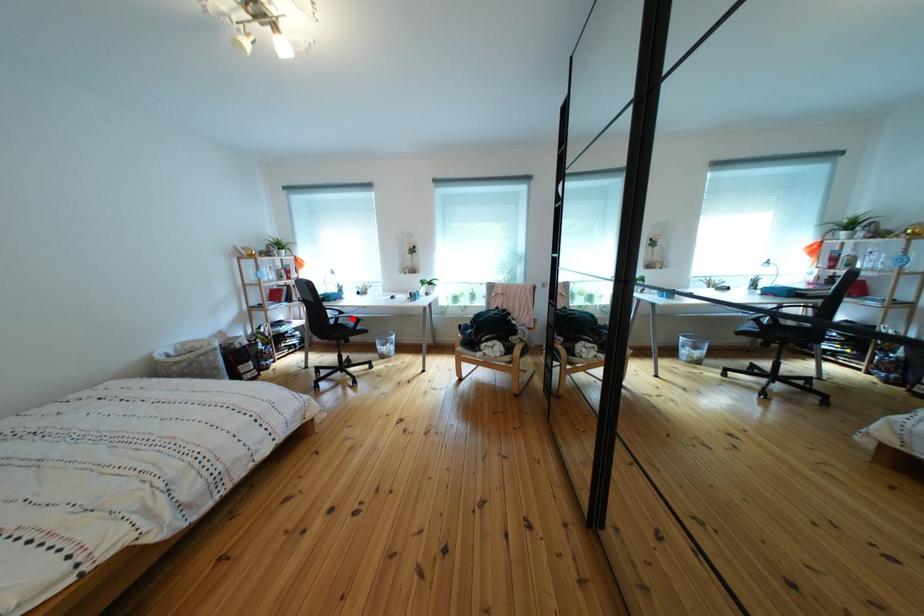
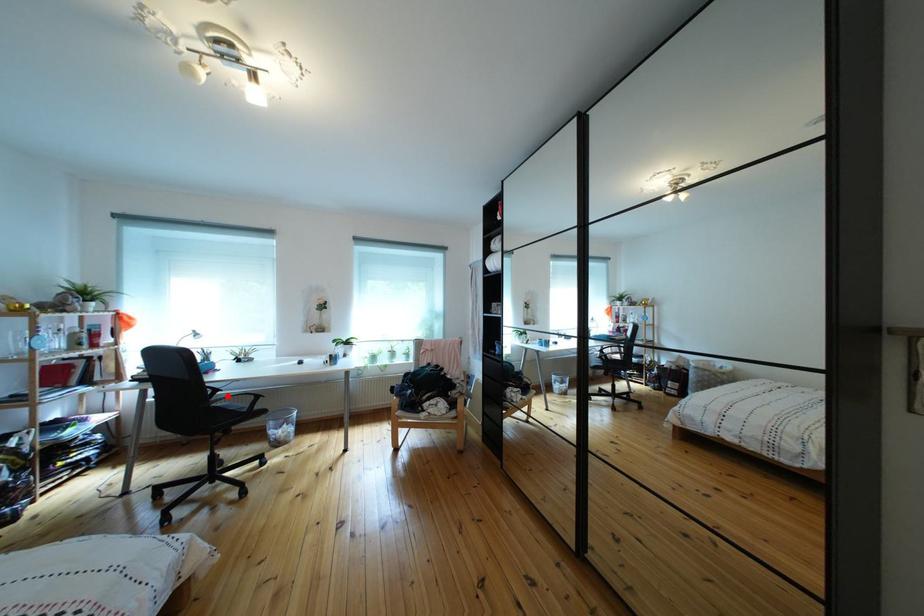
I am providing you with two images of the same scene from different viewpoints. A red point is marked on the first image and another point is marked on the second image. Is the red point in image1 aligned with the point shown in image2?

Yes